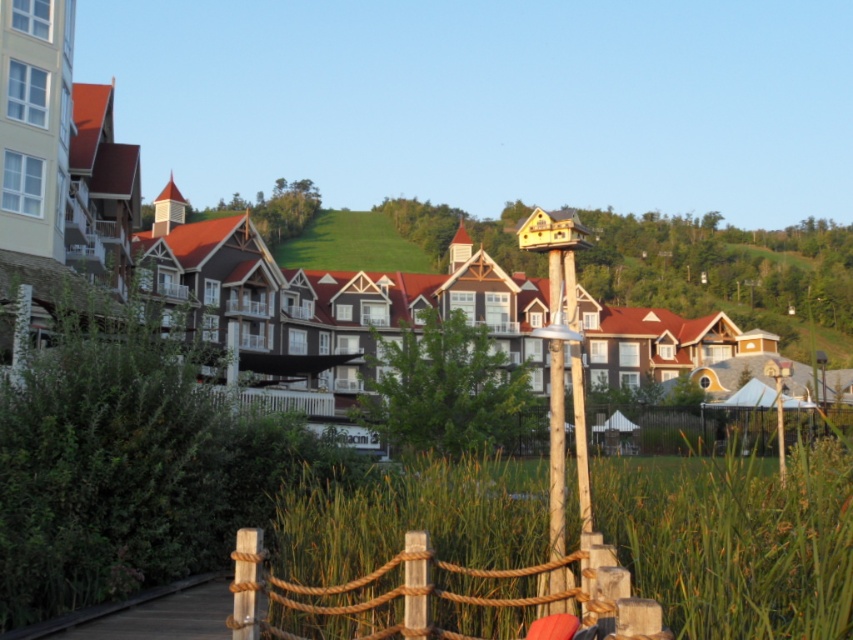
Question: Can you confirm if rope wood at center is positioned to the left of wooden post at center?

Choices:
 (A) yes
 (B) no

Answer: (A)

Question: Which of the following is the closest to the observer?

Choices:
 (A) brown wooden fence at center
 (B) wooden post at center
 (C) rope wood at center

Answer: (C)

Question: Which point is closer to the camera taking this photo?

Choices:
 (A) (834, 420)
 (B) (534, 170)

Answer: (A)

Question: Does rope wood at center appear on the right side of wooden post at center?

Choices:
 (A) no
 (B) yes

Answer: (A)

Question: Considering the real-world distances, which object is closest to the brown wooden fence at center?

Choices:
 (A) brown wooden houses at center
 (B) rope wood at center

Answer: (B)

Question: Observing the image, what is the correct spatial positioning of rope wood at center in reference to wooden post at center?

Choices:
 (A) right
 (B) left

Answer: (B)